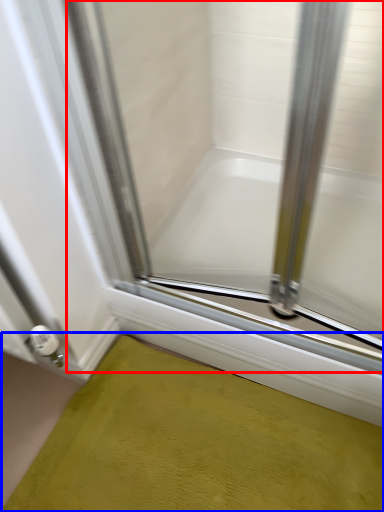
Question: Among these objects, which one is nearest to the camera, glass door (highlighted by a red box) or bath mat (highlighted by a blue box)?

Choices:
 (A) glass door
 (B) bath mat

Answer: (A)